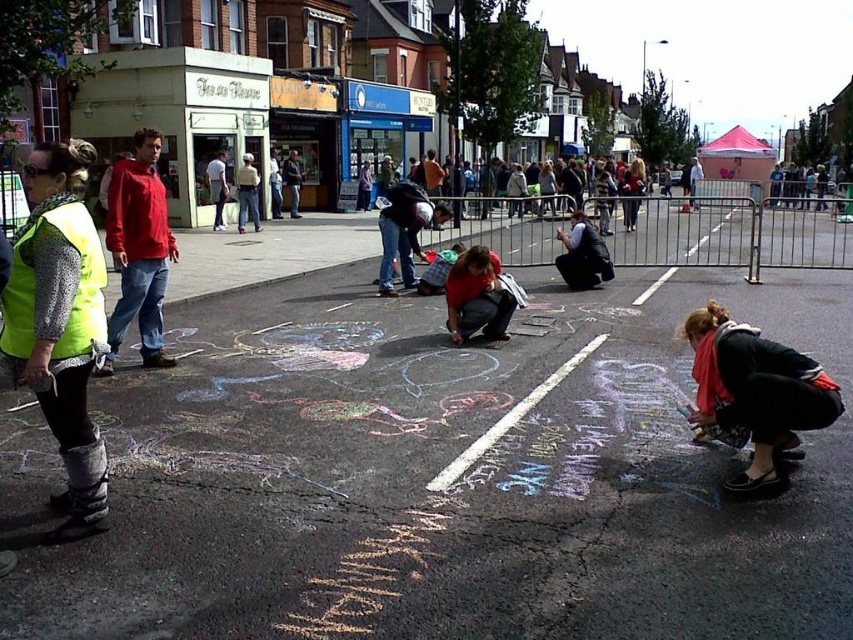
Question: Which of the following is the farthest from the observer?

Choices:
 (A) (483, 289)
 (B) (519, 333)

Answer: (B)

Question: Which is nearer to the matte black jacket at center?

Choices:
 (A) matte red shirt at center
 (B) neon yellow reflective vest at left
 (C) black fabric scarf at lower right

Answer: (C)

Question: Which of the following is the farthest from the observer?

Choices:
 (A) red fabric at center
 (B) neon yellow reflective vest at left

Answer: (A)

Question: Observing the image, what is the correct spatial positioning of chalk drawing at center in reference to matte black jacket at center?

Choices:
 (A) above
 (B) below

Answer: (B)

Question: Does chalk drawing at center have a greater width compared to black fabric scarf at lower right?

Choices:
 (A) yes
 (B) no

Answer: (A)

Question: Where is matte black jacket at center located in relation to matte red shirt at center in the image?

Choices:
 (A) above
 (B) below

Answer: (B)